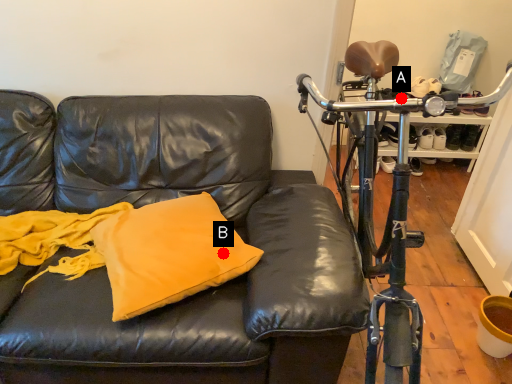
Question: Two points are circled on the image, labeled by A and B beside each circle. Which point is closer to the camera?

Choices:
 (A) A is closer
 (B) B is closer

Answer: (B)